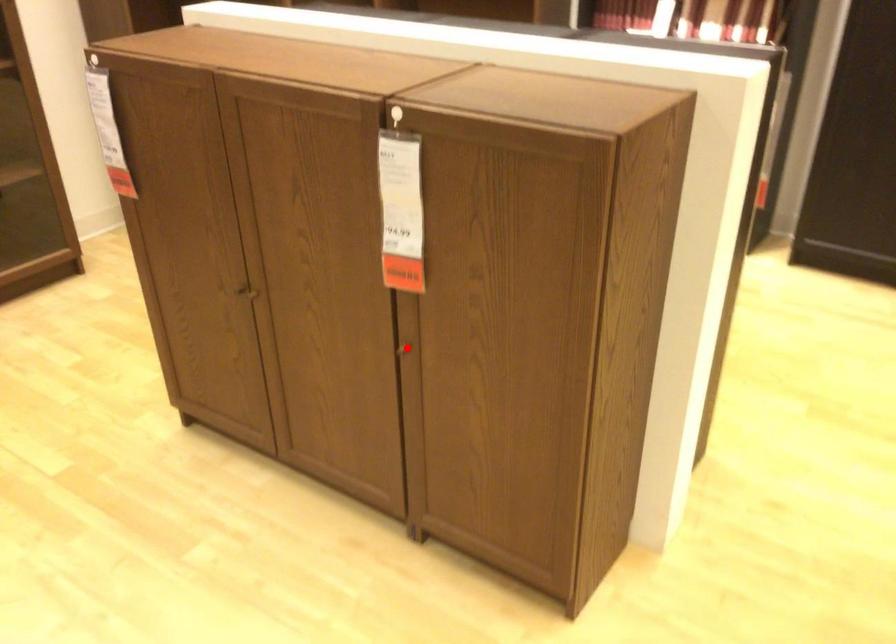
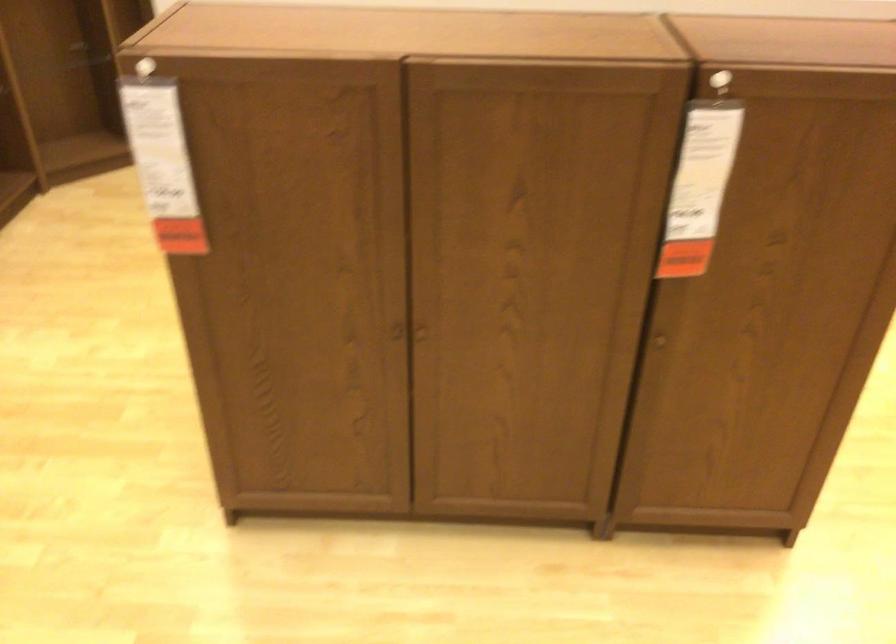
Question: I am providing you with two images of the same scene from different viewpoints. A red point is shown in image1. For the corresponding object point in image2, is it positioned nearer or farther from the camera?

Choices:
 (A) Nearer
 (B) Farther

Answer: (A)